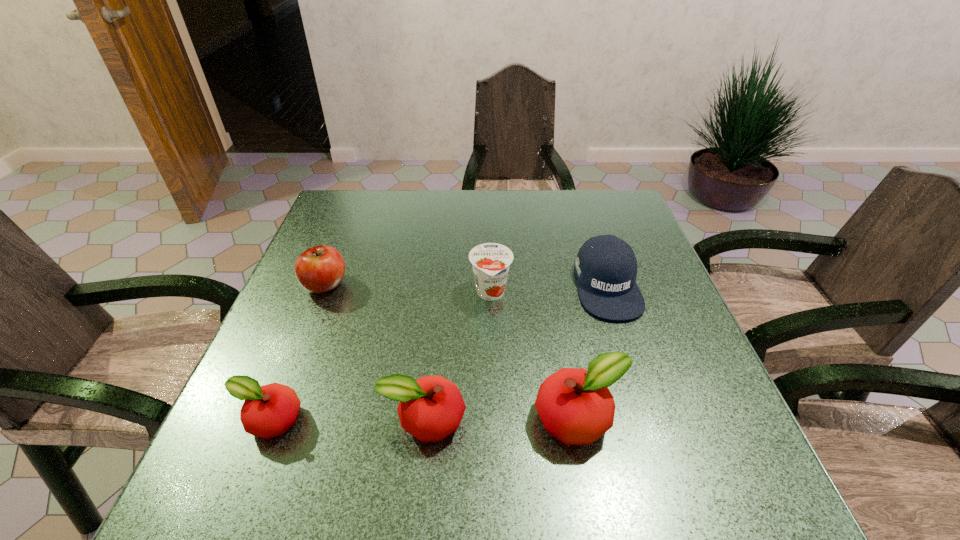
The image size is (960, 540). Find the location of `vacant space in between the yogurt and the shortest object`. vacant space in between the yogurt and the shortest object is located at coordinates (380, 357).

Locate an element on the screen. empty space that is in between the third apple from left to right and the shortest object is located at coordinates (347, 420).

This screenshot has height=540, width=960. I want to click on free spot between the shortest apple and the farthest apple, so click(x=298, y=353).

At what (x,y) coordinates should I click in order to perform the action: click on unoccupied position between the yogurt and the third apple from left to right. Please return your answer as a coordinate pair (x, y). Looking at the image, I should click on (457, 357).

Locate an element on the screen. free space between the yogurt and the baseball cap is located at coordinates (548, 289).

Where is `vacant point located between the farthest apple and the second apple from right to left`? The width and height of the screenshot is (960, 540). vacant point located between the farthest apple and the second apple from right to left is located at coordinates (374, 352).

Where is `free point between the second apple from right to left and the yogurt`? Image resolution: width=960 pixels, height=540 pixels. free point between the second apple from right to left and the yogurt is located at coordinates (457, 357).

Where is `empty space that is in between the baseball cap and the yogurt`? empty space that is in between the baseball cap and the yogurt is located at coordinates (548, 289).

Identify the location of free space between the farthest apple and the baseball cap. The image size is (960, 540). (466, 285).

Find the location of a particular element. object that is the fifth nearest to the yogurt is located at coordinates (268, 411).